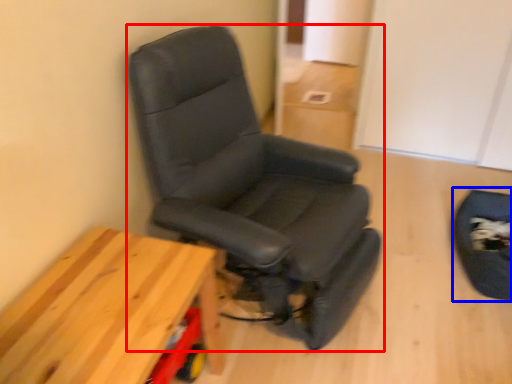
Question: Among these objects, which one is farthest to the camera, chair (highlighted by a red box) or swivel chair (highlighted by a blue box)?

Choices:
 (A) chair
 (B) swivel chair

Answer: (B)